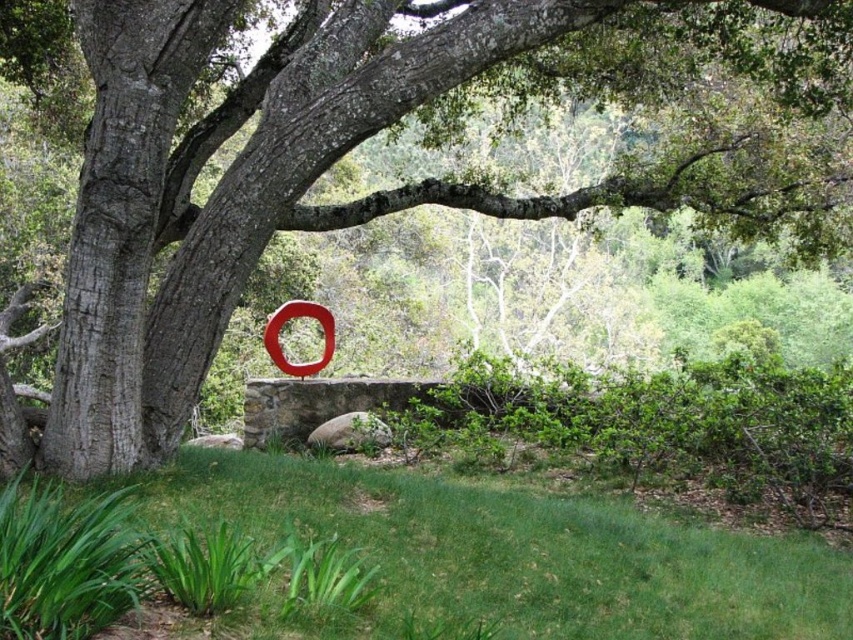
Question: Is green grassy at lower center to the right of smooth red circle at center from the viewer's perspective?

Choices:
 (A) no
 (B) yes

Answer: (B)

Question: Is green grassy at lower center behind smooth red circle at center?

Choices:
 (A) no
 (B) yes

Answer: (A)

Question: Which point is closer to the camera taking this photo?

Choices:
 (A) (321, 314)
 (B) (399, 502)

Answer: (B)

Question: Can you confirm if green grassy at lower center is positioned below smooth red circle at center?

Choices:
 (A) yes
 (B) no

Answer: (A)

Question: Which point is farther from the camera taking this photo?

Choices:
 (A) (662, 634)
 (B) (265, 348)

Answer: (B)